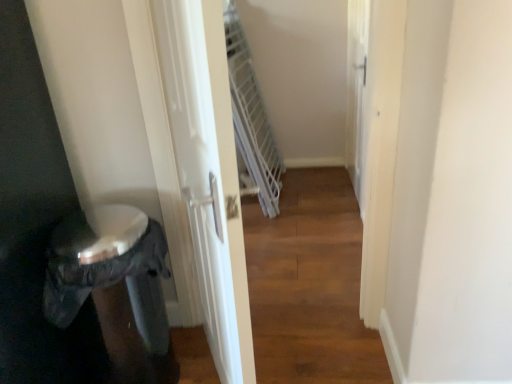
Question: Is white glossy screen door at upper right, which is the second screen door in front-to-back order, to the right of white glossy screen door at center, which appears as the first screen door when viewed from the front, from the viewer's perspective?

Choices:
 (A) no
 (B) yes

Answer: (B)

Question: Can you confirm if white glossy screen door at upper right, which is the second screen door in front-to-back order, is smaller than white glossy screen door at center, the 1th screen door from the left?

Choices:
 (A) yes
 (B) no

Answer: (B)

Question: Is white glossy screen door at upper right, which is the second screen door in front-to-back order, positioned in front of white glossy screen door at center, the 1th screen door from the left?

Choices:
 (A) no
 (B) yes

Answer: (A)

Question: Can you confirm if white glossy screen door at upper right, the 1th screen door viewed from the back, is wider than white glossy screen door at center, the second screen door in the back-to-front sequence?

Choices:
 (A) no
 (B) yes

Answer: (B)

Question: Is white glossy screen door at upper right, the second screen door viewed from the left, positioned beyond the bounds of white glossy screen door at center, the 1th screen door from the left?

Choices:
 (A) no
 (B) yes

Answer: (B)

Question: In the image, is white glossy screen door at center, the 2th screen door viewed from the right, on the left side or the right side of black plastic potty at lower left?

Choices:
 (A) left
 (B) right

Answer: (B)

Question: From a real-world perspective, relative to black plastic potty at lower left, is white glossy screen door at center, the 1th screen door from the left, vertically above or below?

Choices:
 (A) below
 (B) above

Answer: (B)

Question: From the image's perspective, is white glossy screen door at center, the 2th screen door viewed from the right, located above or below black plastic potty at lower left?

Choices:
 (A) above
 (B) below

Answer: (A)

Question: Does point (174, 23) appear closer or farther from the camera than point (125, 205)?

Choices:
 (A) closer
 (B) farther

Answer: (A)

Question: Is black plastic potty at lower left bigger or smaller than white glossy screen door at center, the second screen door in the back-to-front sequence?

Choices:
 (A) big
 (B) small

Answer: (A)

Question: Considering the positions of black plastic potty at lower left and white glossy screen door at center, the 1th screen door from the left, in the image, is black plastic potty at lower left taller or shorter than white glossy screen door at center, the 1th screen door from the left,?

Choices:
 (A) short
 (B) tall

Answer: (A)

Question: Does point click(138, 243) appear closer or farther from the camera than point click(216, 135)?

Choices:
 (A) farther
 (B) closer

Answer: (A)

Question: Considering the positions of black plastic potty at lower left and white glossy screen door at center, which appears as the first screen door when viewed from the front, in the image, is black plastic potty at lower left wider or thinner than white glossy screen door at center, which appears as the first screen door when viewed from the front,?

Choices:
 (A) wide
 (B) thin

Answer: (A)

Question: In the image, is white glossy screen door at upper right, which ranks as the 1th screen door in right-to-left order, on the left side or the right side of white glossy screen door at center, which appears as the first screen door when viewed from the front?

Choices:
 (A) right
 (B) left

Answer: (A)

Question: From the image's perspective, is white glossy screen door at upper right, which ranks as the 1th screen door in right-to-left order, positioned above or below white glossy screen door at center, the 1th screen door from the left?

Choices:
 (A) below
 (B) above

Answer: (B)